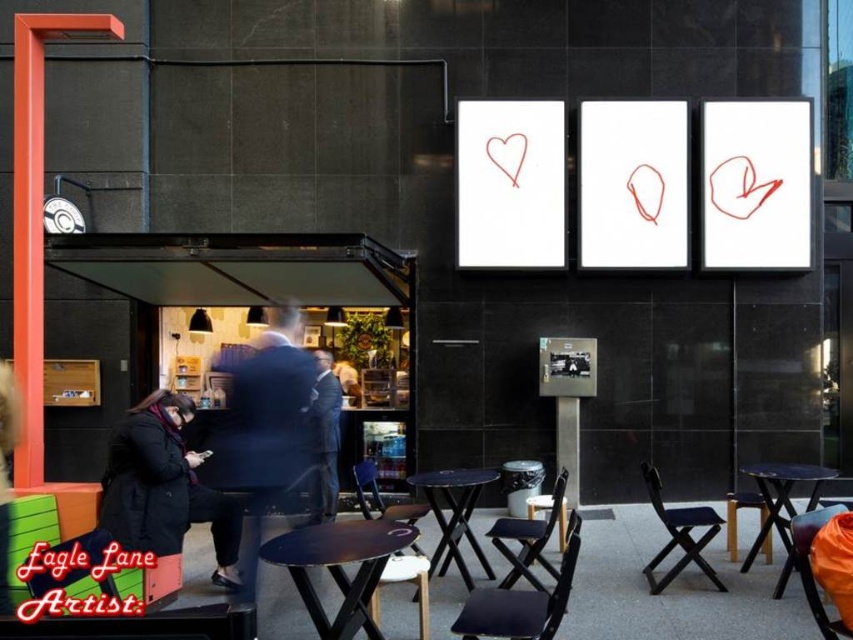
Question: Which object is positioned closest to the wooden stool at lower center?

Choices:
 (A) black fabric chair at center
 (B) black matte table at center

Answer: (A)

Question: Which object appears closest to the camera in this image?

Choices:
 (A) wooden stool at center
 (B) black plastic chair at center
 (C) black fabric chair at lower right
 (D) black plastic table at lower right

Answer: (D)

Question: Is black suit at center smaller than black wool coat at lower left?

Choices:
 (A) yes
 (B) no

Answer: (B)

Question: Can you confirm if black wool coat at lower left is wider than black glossy table at center?

Choices:
 (A) no
 (B) yes

Answer: (B)

Question: Based on their relative distances, which object is nearer to the black matte table at center?

Choices:
 (A) black suit at center
 (B) black wool coat at lower left
 (C) black glossy table at center
 (D) black plastic chair at center

Answer: (D)

Question: Can you confirm if black plastic table at lower right is positioned above dark gray suit at center?

Choices:
 (A) no
 (B) yes

Answer: (A)